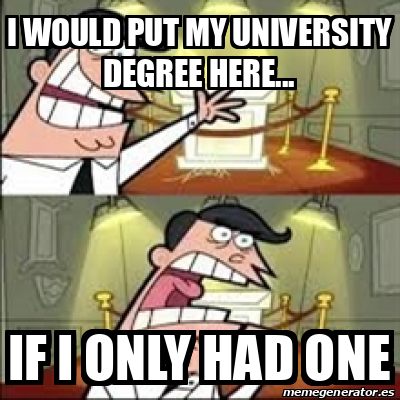
You are a GUI agent. You are given a task and a screenshot of the screen. Output one action in this format:
    pyautogui.click(x=<x>, y=<y>)
    Task: Click on the lamp
    The height and width of the screenshot is (400, 400).
    Given the screenshot: What is the action you would take?
    pyautogui.click(x=132, y=5), pyautogui.click(x=221, y=7), pyautogui.click(x=321, y=5), pyautogui.click(x=322, y=221), pyautogui.click(x=121, y=220), pyautogui.click(x=222, y=204)